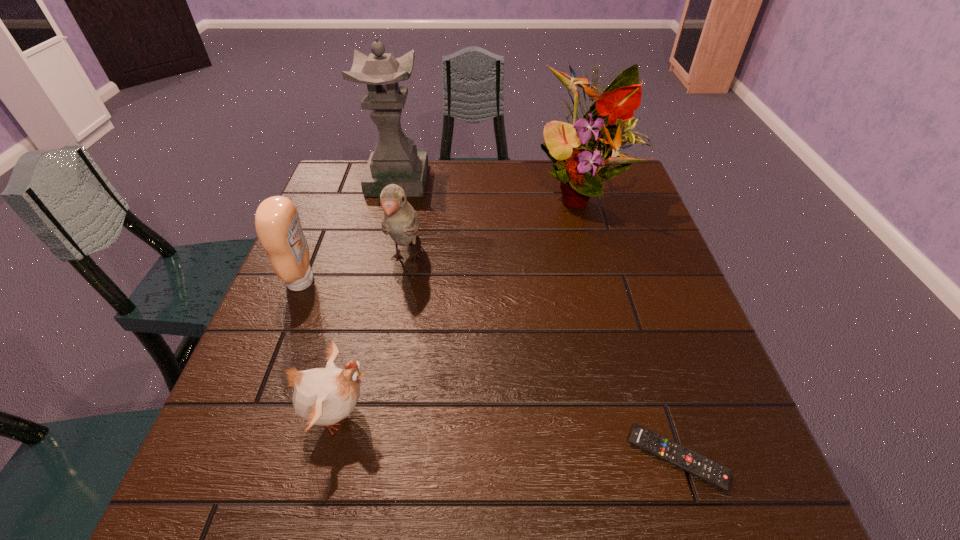
The height and width of the screenshot is (540, 960). I want to click on vacant space at the far left corner of the desktop, so click(363, 171).

Identify the location of free space at the near left corner. The image size is (960, 540). (247, 498).

I want to click on vacant area between the sculpture and the nearer bird, so click(x=369, y=297).

You are a GUI agent. You are given a task and a screenshot of the screen. Output one action in this format:
    pyautogui.click(x=<x>, y=<y>)
    Task: Click on the free space that is in between the bouquet and the leftmost object
    
    Given the screenshot: What is the action you would take?
    pyautogui.click(x=442, y=238)

Where is `vacant area between the taller bird and the remote control`? The height and width of the screenshot is (540, 960). vacant area between the taller bird and the remote control is located at coordinates (541, 357).

Locate an element on the screen. The width and height of the screenshot is (960, 540). vacant region between the remote control and the bouquet is located at coordinates (629, 326).

At what (x,y) coordinates should I click in order to perform the action: click on free space between the leftmost object and the taller bird. Please return your answer as a coordinate pair (x, y). Image resolution: width=960 pixels, height=540 pixels. Looking at the image, I should click on (353, 269).

Find the location of a particular element. The width and height of the screenshot is (960, 540). blank region between the taller bird and the remote control is located at coordinates (541, 357).

Locate an element on the screen. vacant space in between the leftmost object and the farther bird is located at coordinates (353, 269).

This screenshot has width=960, height=540. Find the location of `vacant point located between the condiment and the shortest object`. vacant point located between the condiment and the shortest object is located at coordinates pos(490,369).